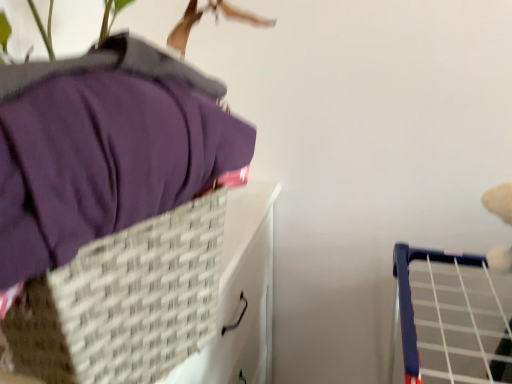
What do you see at coordinates (164, 305) in the screenshot?
I see `woven fabric basket at left` at bounding box center [164, 305].

Measure the distance between woven fabric basket at left and camera.

woven fabric basket at left and camera are 15.45 inches apart.

Locate an element on the screen. woven fabric basket at left is located at coordinates (164, 305).

The image size is (512, 384). I want to click on woven fabric basket at left, so click(x=164, y=305).